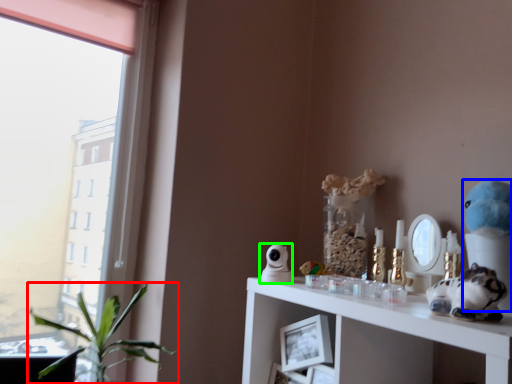
Question: Considering the real-world distances, which object is closest to houseplant (highlighted by a red box)? figurine (highlighted by a blue box) or figurine (highlighted by a green box).

Choices:
 (A) figurine
 (B) figurine

Answer: (B)